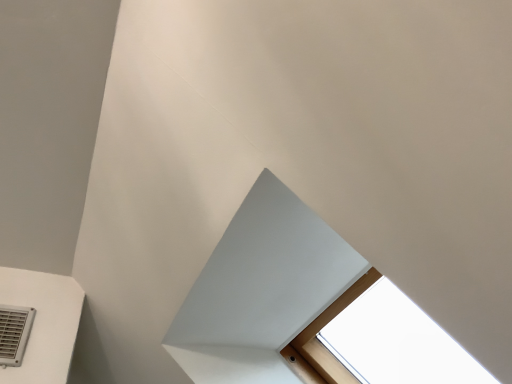
Describe the element at coordinates (261, 289) in the screenshot. I see `white matte exhaust hood at center` at that location.

Consider the image. In order to face white matte exhaust hood at center, should I rotate leftwards or rightwards?

A 2.793 degree turn to the right will do.

Identify the location of white matte exhaust hood at center. (261, 289).

The width and height of the screenshot is (512, 384). Describe the element at coordinates (14, 333) in the screenshot. I see `gray plastic air conditioning at lower left` at that location.

Find the location of a particular element. gray plastic air conditioning at lower left is located at coordinates click(x=14, y=333).

Locate an element on the screen. white matte exhaust hood at center is located at coordinates (261, 289).

Would you say white matte exhaust hood at center is to the left or to the right of gray plastic air conditioning at lower left in the picture?

Based on their positions, white matte exhaust hood at center is located to the right of gray plastic air conditioning at lower left.

Is white matte exhaust hood at center further to the viewer compared to gray plastic air conditioning at lower left?

No, white matte exhaust hood at center is closer to the viewer.

Between point (300, 309) and point (1, 318), which one is positioned behind?

The point (1, 318) is more distant.

From the image's perspective, is white matte exhaust hood at center located beneath gray plastic air conditioning at lower left?

No.

From the picture: From a real-world perspective, is white matte exhaust hood at center below gray plastic air conditioning at lower left?

Correct, in the physical world, white matte exhaust hood at center is lower than gray plastic air conditioning at lower left.

Does white matte exhaust hood at center have a lesser width compared to gray plastic air conditioning at lower left?

In fact, white matte exhaust hood at center might be wider than gray plastic air conditioning at lower left.

From the picture: Considering the sizes of white matte exhaust hood at center and gray plastic air conditioning at lower left in the image, is white matte exhaust hood at center taller or shorter than gray plastic air conditioning at lower left?

Clearly, white matte exhaust hood at center is shorter compared to gray plastic air conditioning at lower left.

Is white matte exhaust hood at center smaller than gray plastic air conditioning at lower left?

Incorrect, white matte exhaust hood at center is not smaller in size than gray plastic air conditioning at lower left.

Is white matte exhaust hood at center spatially inside gray plastic air conditioning at lower left, or outside of it?

white matte exhaust hood at center is not inside gray plastic air conditioning at lower left, it's outside.

Is white matte exhaust hood at center touching gray plastic air conditioning at lower left?

No, white matte exhaust hood at center is not in contact with gray plastic air conditioning at lower left.

Is white matte exhaust hood at center facing towards gray plastic air conditioning at lower left?

No.

How many degrees apart are the facing directions of white matte exhaust hood at center and gray plastic air conditioning at lower left?

There is a 90.2-degree angle between the facing directions of white matte exhaust hood at center and gray plastic air conditioning at lower left.

Measure the distance from white matte exhaust hood at center to gray plastic air conditioning at lower left.

white matte exhaust hood at center and gray plastic air conditioning at lower left are 26.68 inches apart from each other.

Where is `exhaust hood in front of the gray plastic air conditioning at lower left`? The width and height of the screenshot is (512, 384). exhaust hood in front of the gray plastic air conditioning at lower left is located at coordinates (261, 289).

From the picture: Considering the relative positions of gray plastic air conditioning at lower left and white matte exhaust hood at center in the image provided, is gray plastic air conditioning at lower left to the left of white matte exhaust hood at center from the viewer's perspective?

Indeed, gray plastic air conditioning at lower left is positioned on the left side of white matte exhaust hood at center.

Which is behind, gray plastic air conditioning at lower left or white matte exhaust hood at center?

gray plastic air conditioning at lower left is behind.

Is point (8, 331) closer to camera compared to point (265, 252)?

No, it is behind (265, 252).

From the image's perspective, which is below, gray plastic air conditioning at lower left or white matte exhaust hood at center?

gray plastic air conditioning at lower left, from the image's perspective.

From a real-world perspective, which is physically below, gray plastic air conditioning at lower left or white matte exhaust hood at center?

In real-world perspective, white matte exhaust hood at center is lower.

In terms of width, does gray plastic air conditioning at lower left look wider or thinner when compared to white matte exhaust hood at center?

Considering their sizes, gray plastic air conditioning at lower left looks slimmer than white matte exhaust hood at center.

Can you confirm if gray plastic air conditioning at lower left is shorter than white matte exhaust hood at center?

No.

Considering the sizes of gray plastic air conditioning at lower left and white matte exhaust hood at center in the image, is gray plastic air conditioning at lower left bigger or smaller than white matte exhaust hood at center?

Considering their sizes, gray plastic air conditioning at lower left takes up less space than white matte exhaust hood at center.

Is white matte exhaust hood at center completely or partially inside gray plastic air conditioning at lower left?

No.

Is gray plastic air conditioning at lower left placed right next to white matte exhaust hood at center?

There is a gap between gray plastic air conditioning at lower left and white matte exhaust hood at center.

Is gray plastic air conditioning at lower left turned away from white matte exhaust hood at center?

No, gray plastic air conditioning at lower left is not facing away from white matte exhaust hood at center.

Can you tell me how much gray plastic air conditioning at lower left and white matte exhaust hood at center differ in facing direction?

There is a 90.2-degree angle between the facing directions of gray plastic air conditioning at lower left and white matte exhaust hood at center.

At what (x,y) coordinates should I click in order to perform the action: click on air conditioning located above the white matte exhaust hood at center (from a real-world perspective). Please return your answer as a coordinate pair (x, y). The width and height of the screenshot is (512, 384). Looking at the image, I should click on (x=14, y=333).

Locate an element on the screen. The width and height of the screenshot is (512, 384). exhaust hood that appears on the right of gray plastic air conditioning at lower left is located at coordinates (261, 289).

This screenshot has width=512, height=384. In order to click on exhaust hood above the gray plastic air conditioning at lower left (from the image's perspective) in this screenshot , I will do `click(261, 289)`.